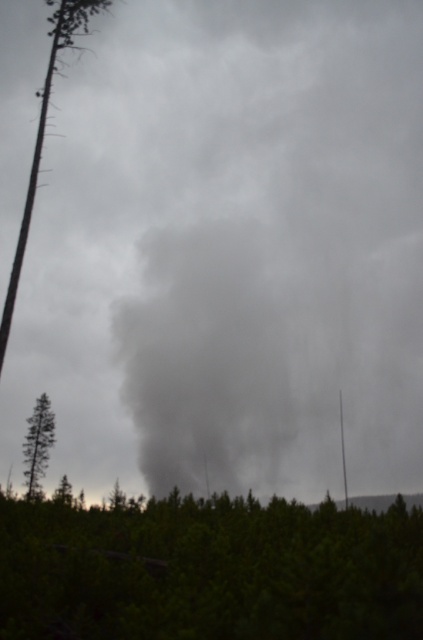
Question: Does green matte forest at lower center appear over green matte tree at left?

Choices:
 (A) yes
 (B) no

Answer: (A)

Question: Is the position of green matte forest at lower center more distant than that of smooth bark tree at left?

Choices:
 (A) yes
 (B) no

Answer: (B)

Question: Which of the following is the closest to the observer?

Choices:
 (A) green matte forest at lower center
 (B) smooth bark tree at left

Answer: (A)

Question: Observing the image, what is the correct spatial positioning of smooth bark tree at left in reference to green matte tree at left?

Choices:
 (A) right
 (B) left

Answer: (A)

Question: Which object appears closest to the camera in this image?

Choices:
 (A) green matte tree at left
 (B) green matte forest at lower center

Answer: (B)

Question: Which object is positioned farthest from the green matte forest at lower center?

Choices:
 (A) green matte tree at left
 (B) smooth bark tree at left

Answer: (A)